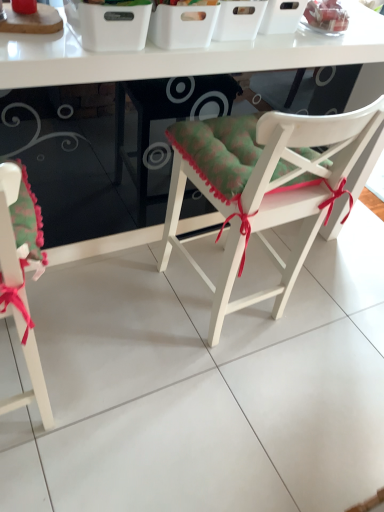
What is the approximate height of matte green cushion at lower left, acting as the 2th chair starting from the right?

It is 36.55 inches.

The height and width of the screenshot is (512, 384). What are the coordinates of `matte green cushion at lower left, acting as the 2th chair starting from the right` in the screenshot? It's located at (20, 284).

Identify the location of matte green cushion at lower left, the 1th chair from the left. This screenshot has height=512, width=384. (20, 284).

Is white wood chair at center, arranged as the 1th chair when viewed from the right, surrounded by matte green cushion at lower left, the 1th chair from the left?

No, white wood chair at center, arranged as the 1th chair when viewed from the right, is not a part of matte green cushion at lower left, the 1th chair from the left.

Are matte green cushion at lower left, the 1th chair from the left, and white wood chair at center, arranged as the 1th chair when viewed from the right, far apart?

matte green cushion at lower left, the 1th chair from the left, is near white wood chair at center, arranged as the 1th chair when viewed from the right, not far away.

From a real-world perspective, is matte green cushion at lower left, acting as the 2th chair starting from the right, positioned above or below white wood chair at center, arranged as the second chair when viewed from the left?

matte green cushion at lower left, acting as the 2th chair starting from the right, is below white wood chair at center, arranged as the second chair when viewed from the left.

Is point (4, 212) closer to viewer compared to point (211, 290)?

Yes.

Is white glossy table at center inside matte green cushion at lower left, acting as the 2th chair starting from the right?

That's incorrect, white glossy table at center is not inside matte green cushion at lower left, acting as the 2th chair starting from the right.

Is matte green cushion at lower left, the 1th chair from the left, oriented towards white glossy table at center?

No.

Can you tell me how much matte green cushion at lower left, acting as the 2th chair starting from the right, and white glossy table at center differ in facing direction?

matte green cushion at lower left, acting as the 2th chair starting from the right, and white glossy table at center are facing 2.43 degrees away from each other.

From the image's perspective, is matte green cushion at lower left, the 1th chair from the left, above or below white glossy table at center?

Based on their image positions, matte green cushion at lower left, the 1th chair from the left, is located beneath white glossy table at center.

The image size is (384, 512). I want to click on table behind the matte green cushion at lower left, the 1th chair from the left, so click(184, 55).

Which is correct: white glossy table at center is inside matte green cushion at lower left, the 1th chair from the left, or outside of it?

white glossy table at center is spatially situated outside matte green cushion at lower left, the 1th chair from the left.

Considering the sizes of white glossy table at center and matte green cushion at lower left, the 1th chair from the left, in the image, is white glossy table at center taller or shorter than matte green cushion at lower left, the 1th chair from the left,?

In the image, white glossy table at center appears to be taller than matte green cushion at lower left, the 1th chair from the left.

In terms of size, does white glossy table at center appear bigger or smaller than matte green cushion at lower left, acting as the 2th chair starting from the right?

In the image, white glossy table at center appears to be larger than matte green cushion at lower left, acting as the 2th chair starting from the right.

Does white wood chair at center, arranged as the second chair when viewed from the left, have a smaller size compared to white glossy table at center?

Yes.

Is white wood chair at center, arranged as the second chair when viewed from the left, situated inside white glossy table at center or outside?

white wood chair at center, arranged as the second chair when viewed from the left, is not enclosed by white glossy table at center.

How much distance is there between white wood chair at center, arranged as the second chair when viewed from the left, and white glossy table at center?

white wood chair at center, arranged as the second chair when viewed from the left, and white glossy table at center are 16.03 inches apart from each other.

Measure the distance from white plastic basket at upper center to white glossy table at center.

They are 8.81 inches apart.

Would you say white plastic basket at upper center is a long distance from white glossy table at center?

They are positioned close to each other.

Considering the sizes of white plastic basket at upper center and white glossy table at center in the image, is white plastic basket at upper center wider or thinner than white glossy table at center?

In the image, white plastic basket at upper center appears to be more narrow than white glossy table at center.

Between white plastic basket at upper center and white glossy table at center, which one has less height?

With less height is white plastic basket at upper center.

From the image's perspective, is white glossy table at center over white wood chair at center, arranged as the 1th chair when viewed from the right?

Yes, from the image's perspective, white glossy table at center is over white wood chair at center, arranged as the 1th chair when viewed from the right.

Considering the relative sizes of white glossy table at center and white wood chair at center, arranged as the second chair when viewed from the left, in the image provided, is white glossy table at center shorter than white wood chair at center, arranged as the second chair when viewed from the left,?

Incorrect, the height of white glossy table at center does not fall short of that of white wood chair at center, arranged as the second chair when viewed from the left.

Which is in front, white glossy table at center or white wood chair at center, arranged as the 1th chair when viewed from the right?

white wood chair at center, arranged as the 1th chair when viewed from the right.

Which object is wider, white glossy table at center or white wood chair at center, arranged as the second chair when viewed from the left?

white glossy table at center is wider.

Is matte green cushion at lower left, acting as the 2th chair starting from the right, shorter than white plastic basket at upper center?

In fact, matte green cushion at lower left, acting as the 2th chair starting from the right, may be taller than white plastic basket at upper center.

From a real-world perspective, which is physically below, matte green cushion at lower left, the 1th chair from the left, or white plastic basket at upper center?

From a 3D spatial view, matte green cushion at lower left, the 1th chair from the left, is below.

Can you confirm if matte green cushion at lower left, the 1th chair from the left, is thinner than white plastic basket at upper center?

No.

Does matte green cushion at lower left, the 1th chair from the left, turn towards white plastic basket at upper center?

No, matte green cushion at lower left, the 1th chair from the left, is not aimed at white plastic basket at upper center.

Locate an element on the screen. The image size is (384, 512). chair located above the matte green cushion at lower left, the 1th chair from the left (from a real-world perspective) is located at coordinates (263, 187).

Where is `chair that appears on the left of white glossy table at center`? chair that appears on the left of white glossy table at center is located at coordinates (20, 284).

Based on their spatial positions, is white wood chair at center, arranged as the second chair when viewed from the left, or white plastic basket at upper center closer to matte green cushion at lower left, the 1th chair from the left?

white wood chair at center, arranged as the second chair when viewed from the left, lies closer to matte green cushion at lower left, the 1th chair from the left, than the other object.

From the image, which object appears to be farther from matte green cushion at lower left, acting as the 2th chair starting from the right, white glossy table at center or white wood chair at center, arranged as the 1th chair when viewed from the right?

white wood chair at center, arranged as the 1th chair when viewed from the right.

When comparing their distances from white glossy table at center, does white wood chair at center, arranged as the 1th chair when viewed from the right, or white plastic basket at upper center seem closer?

white plastic basket at upper center.

Based on their spatial positions, is white plastic basket at upper center or matte green cushion at lower left, acting as the 2th chair starting from the right, further from white wood chair at center, arranged as the 1th chair when viewed from the right?

The object further to white wood chair at center, arranged as the 1th chair when viewed from the right, is matte green cushion at lower left, acting as the 2th chair starting from the right.

Which object lies nearer to the anchor point matte green cushion at lower left, acting as the 2th chair starting from the right, white plastic basket at upper center or white wood chair at center, arranged as the second chair when viewed from the left?

The object closer to matte green cushion at lower left, acting as the 2th chair starting from the right, is white wood chair at center, arranged as the second chair when viewed from the left.

Considering their positions, is white glossy table at center positioned closer to matte green cushion at lower left, the 1th chair from the left, than white plastic basket at upper center?

white glossy table at center is closer to matte green cushion at lower left, the 1th chair from the left.

Based on the photo, estimate the real-world distances between objects in this image. Which object is closer to white wood chair at center, arranged as the 1th chair when viewed from the right, white glossy table at center or white plastic basket at upper center?

white glossy table at center is closer to white wood chair at center, arranged as the 1th chair when viewed from the right.

Looking at the image, which one is located further to white plastic basket at upper center, white glossy table at center or matte green cushion at lower left, the 1th chair from the left?

matte green cushion at lower left, the 1th chair from the left, is positioned further to the anchor white plastic basket at upper center.

Locate an element on the screen. chair that lies between white plastic basket at upper center and matte green cushion at lower left, the 1th chair from the left, from top to bottom is located at coordinates (263, 187).

You are a GUI agent. You are given a task and a screenshot of the screen. Output one action in this format:
    pyautogui.click(x=<x>, y=<y>)
    Task: Click on the table between matte green cushion at lower left, the 1th chair from the left, and white wood chair at center, arranged as the 1th chair when viewed from the right, from left to right
    Image resolution: width=384 pixels, height=512 pixels.
    Given the screenshot: What is the action you would take?
    pyautogui.click(x=184, y=55)

You are a GUI agent. You are given a task and a screenshot of the screen. Output one action in this format:
    pyautogui.click(x=<x>, y=<y>)
    Task: Click on the table between white plastic basket at upper center and white wood chair at center, arranged as the second chair when viewed from the left, vertically
    Image resolution: width=384 pixels, height=512 pixels.
    Given the screenshot: What is the action you would take?
    pyautogui.click(x=184, y=55)

Where is `table between white plastic basket at upper center and matte green cushion at lower left, the 1th chair from the left, in the vertical direction`? The width and height of the screenshot is (384, 512). table between white plastic basket at upper center and matte green cushion at lower left, the 1th chair from the left, in the vertical direction is located at coordinates (184, 55).